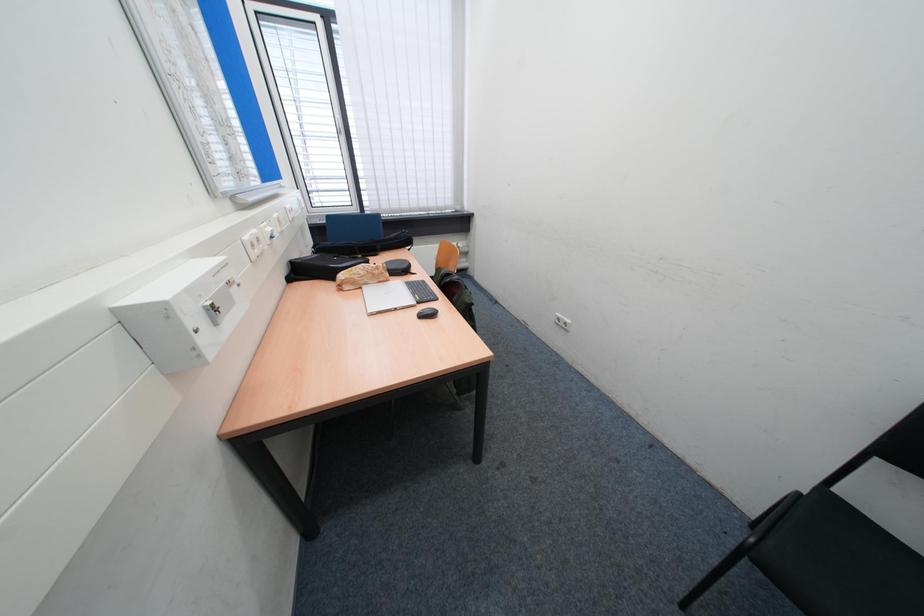
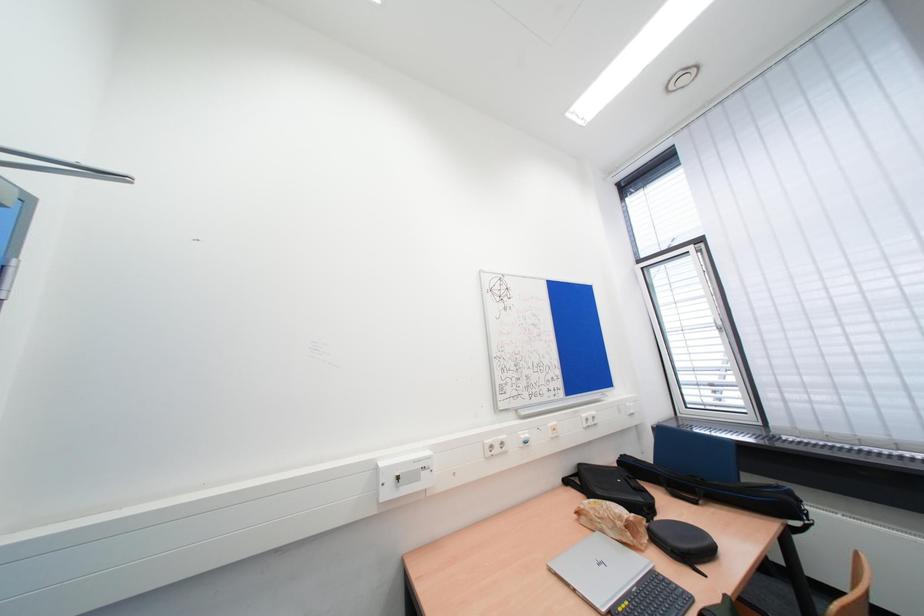
Question: The images are taken continuously from a first-person perspective. In which direction is your viewpoint rotating?

Choices:
 (A) Left
 (B) Right
 (C) Up
 (D) Down

Answer: (A)